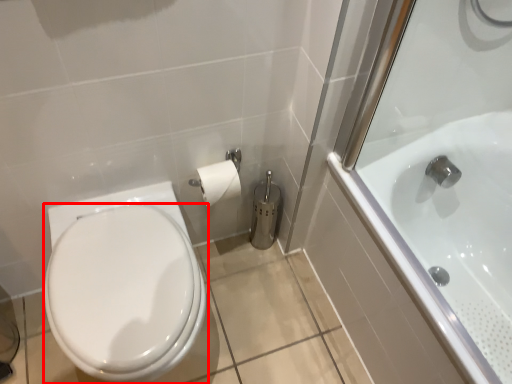
Question: From the image's perspective, considering the relative positions of bidet (annotated by the red box) and bathtub in the image provided, where is bidet (annotated by the red box) located with respect to the staircase?

Choices:
 (A) below
 (B) above

Answer: (A)